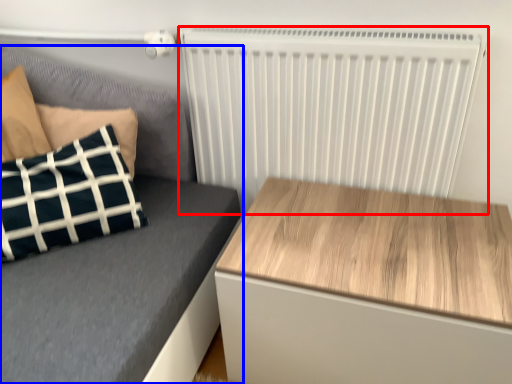
Question: Which object appears closest to the camera in this image, radiator (highlighted by a red box) or furniture (highlighted by a blue box)?

Choices:
 (A) radiator
 (B) furniture

Answer: (B)